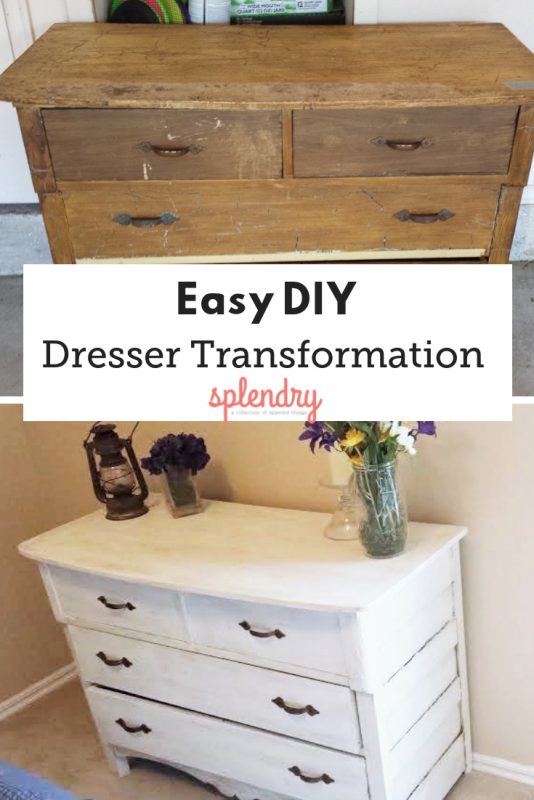
This screenshot has height=800, width=534. Identify the location of floor. (523, 304), (11, 330).